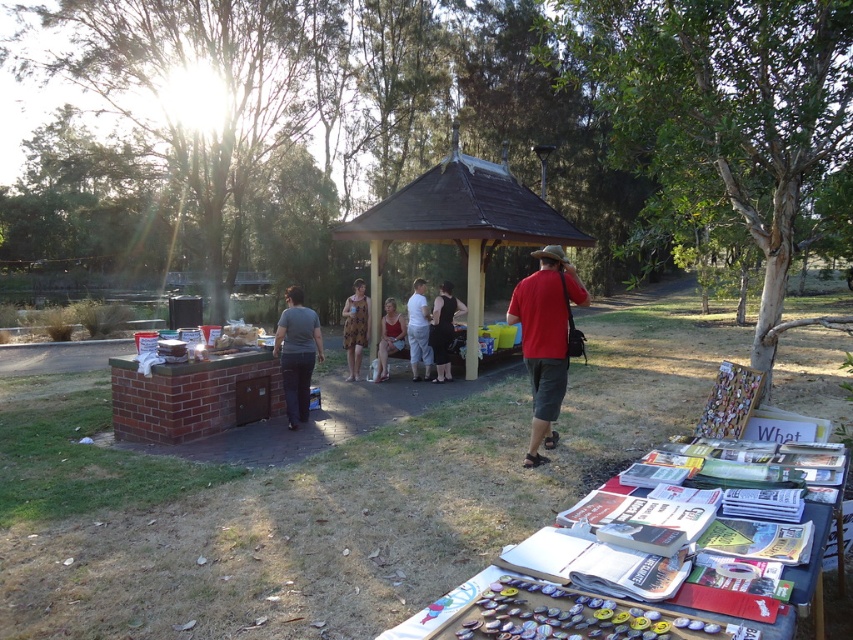
Question: Does black smooth dress at center appear over matte red dress at center?

Choices:
 (A) no
 (B) yes

Answer: (B)

Question: Which point is farther from the camera taking this photo?

Choices:
 (A) (360, 305)
 (B) (549, 369)

Answer: (A)

Question: Which of the following is the closest to the observer?

Choices:
 (A) gray cotton shirt at center
 (B) red matte shirt at center
 (C) white cotton shirt at center
 (D) black smooth dress at center

Answer: (B)

Question: Is black smooth dress at center smaller than white cotton shirt at center?

Choices:
 (A) yes
 (B) no

Answer: (B)

Question: Is wooden gazebo at center further to camera compared to gray cotton shirt at center?

Choices:
 (A) yes
 (B) no

Answer: (A)

Question: Which object is the farthest from the wooden gazebo at center?

Choices:
 (A) patterned fabric dress at center
 (B) black smooth dress at center
 (C) white cotton shirt at center
 (D) wooden picnic table at lower right

Answer: (D)